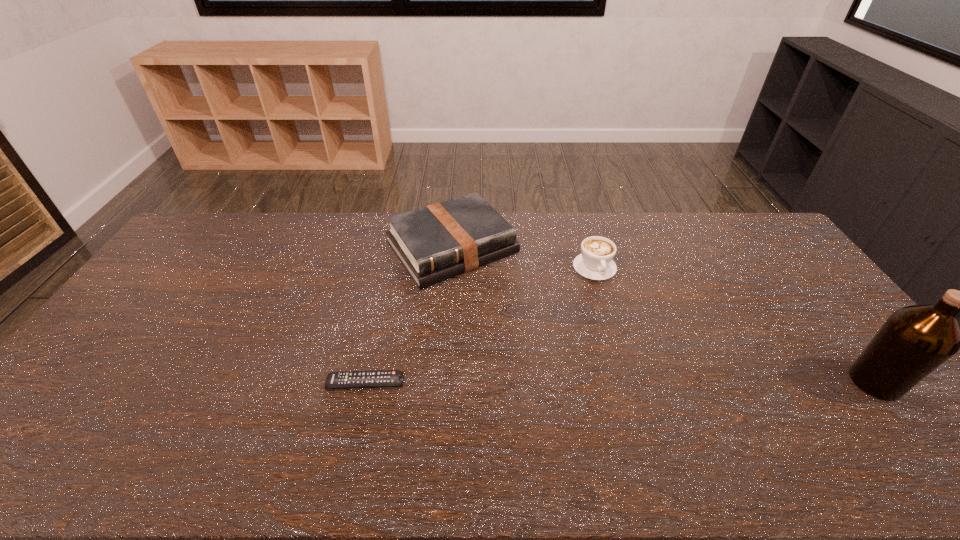
Identify the location of vacant area that lies between the shortest object and the second object from right to left. (480, 325).

You are a GUI agent. You are given a task and a screenshot of the screen. Output one action in this format:
    pyautogui.click(x=<x>, y=<y>)
    Task: Click on the empty space between the cappuccino and the shortest object
    This screenshot has height=540, width=960.
    Given the screenshot: What is the action you would take?
    pyautogui.click(x=480, y=325)

You are a GUI agent. You are given a task and a screenshot of the screen. Output one action in this format:
    pyautogui.click(x=<x>, y=<y>)
    Task: Click on the object that is the closest to the shortest object
    
    Given the screenshot: What is the action you would take?
    pyautogui.click(x=439, y=241)

Identify the location of object that is the third closest to the hardback book. (915, 340).

Identify the location of blank area in the image that satisfies the following two spatial constraints: 1. on the back side of the shortest object; 2. on the label of the olive oil. The height and width of the screenshot is (540, 960). (365, 382).

Where is `free space that satisfies the following two spatial constraints: 1. on the front side of the hardback book; 2. on the label of the olive oil`? The height and width of the screenshot is (540, 960). free space that satisfies the following two spatial constraints: 1. on the front side of the hardback book; 2. on the label of the olive oil is located at coordinates (442, 382).